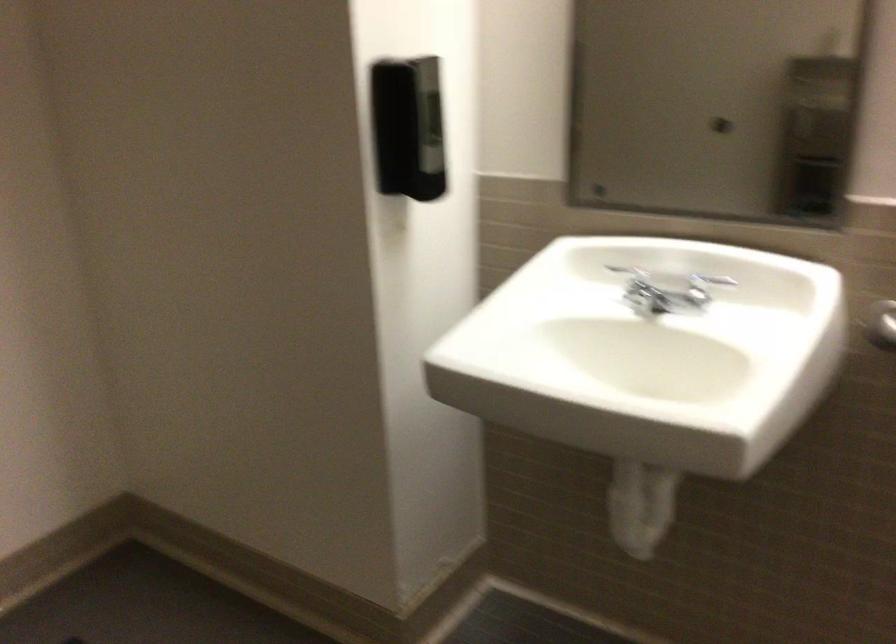
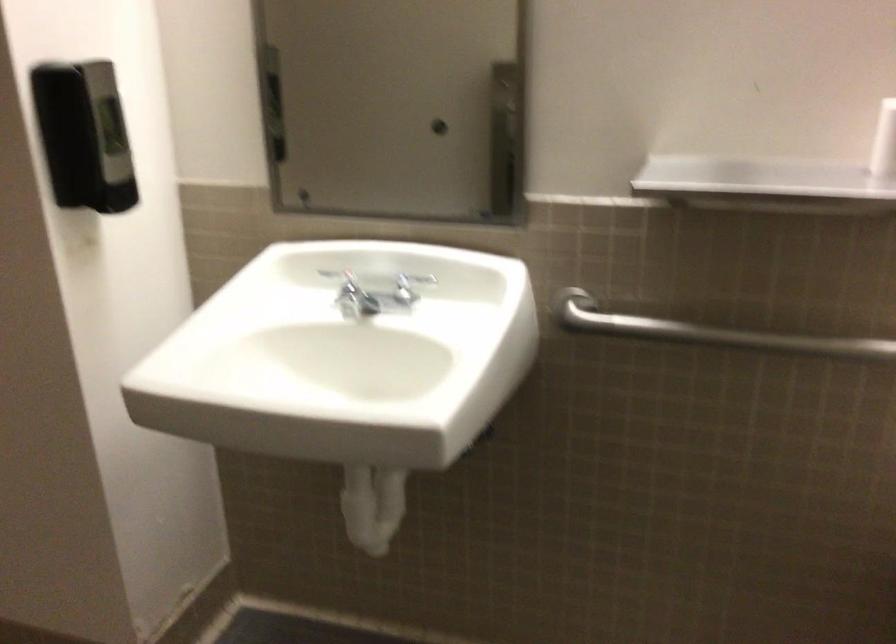
Question: What movement of the cameraman would produce the second image?

Choices:
 (A) Left
 (B) Right
 (C) Forward
 (D) Backward

Answer: (B)